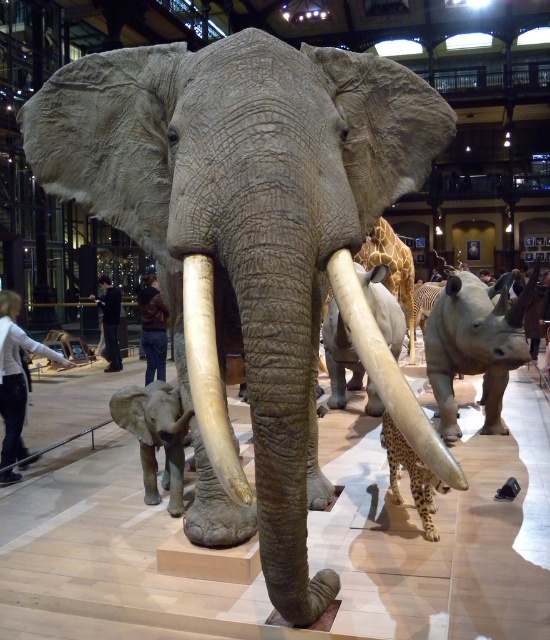
You are standing in the museum exhibit and want to take a photo of the life sized taxidermy elephant. The camera you are using has a maximum focus distance of 4 meters. Will you be able to focus on the elephant if you are standing at point (x=521, y=300)?

The distance between point (x=521, y=300) and the camera is 4.34 meters. Since the maximum focus distance is 4 meters, the camera cannot focus on the elephant from that position.

You are a visitor standing in the museum exhibit. You see the gray matte elephant at lower left and the matte gray rhinoceros at center. Which animal is positioned lower in the exhibit?

The gray matte elephant at lower left is positioned lower than the matte gray rhinoceros at center.